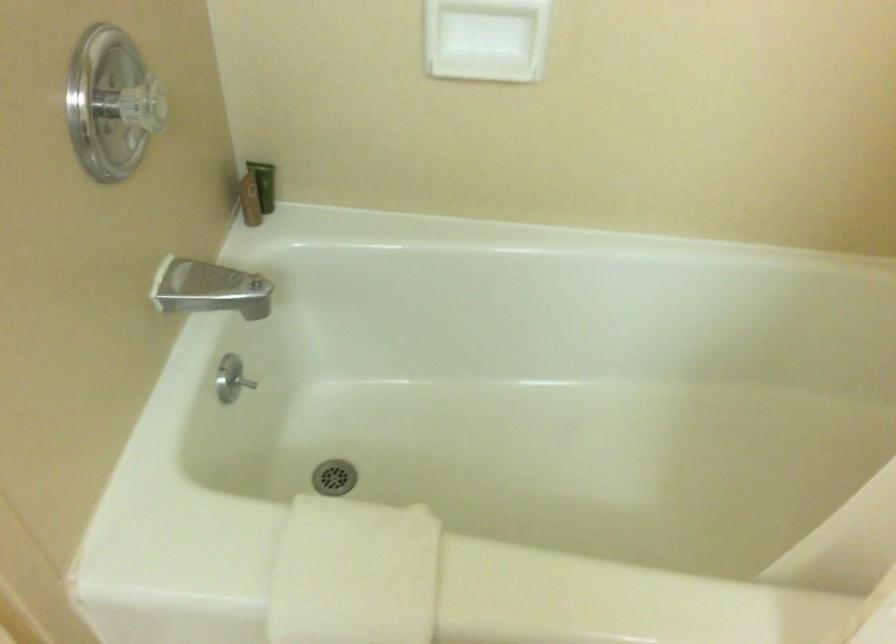
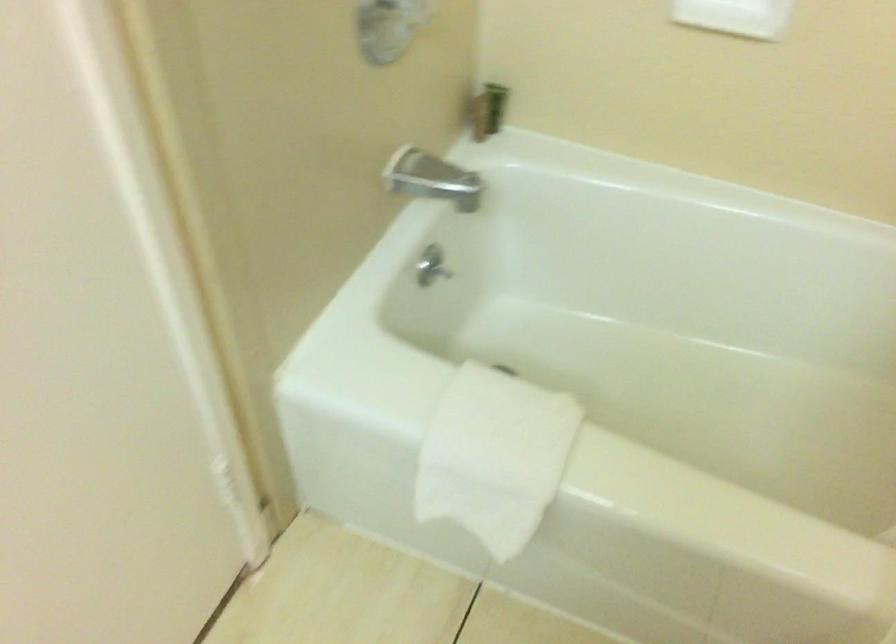
Find the pixel in the second image that matches the point at 231,383 in the first image.

(431, 266)